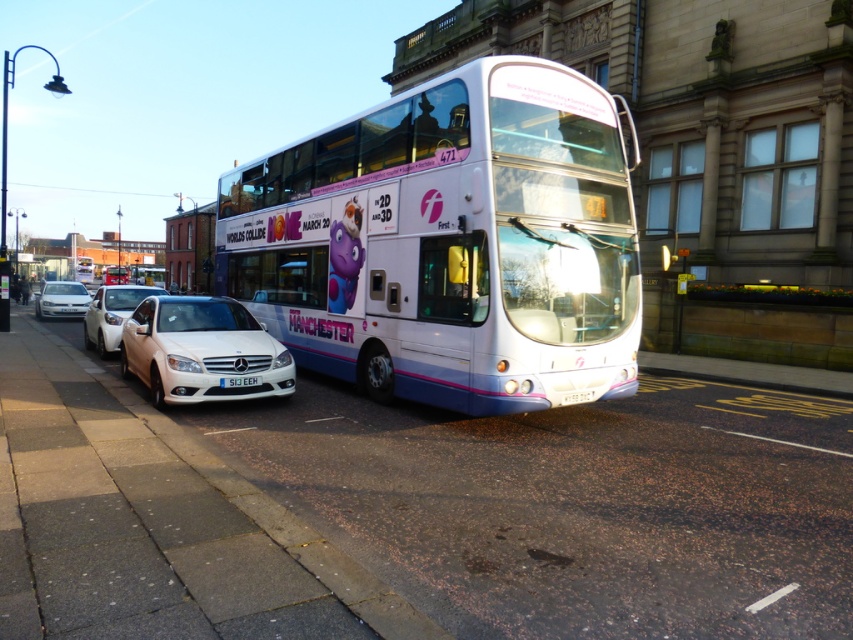
Which is more to the left, silver metallic sedan at left or white plastic license plate at center?

silver metallic sedan at left is more to the left.

Who is more distant from viewer, (x=83, y=314) or (x=247, y=381)?

The point (x=83, y=314) is more distant.

Find the location of a particular element. The width and height of the screenshot is (853, 640). silver metallic sedan at left is located at coordinates (61, 300).

Can you confirm if white glossy sedan at center is wider than white plastic license plate at center?

Correct, the width of white glossy sedan at center exceeds that of white plastic license plate at center.

Which of these two, white glossy sedan at center or white plastic license plate at center, stands taller?

With more height is white glossy sedan at center.

Is point (144, 344) closer to viewer compared to point (238, 381)?

That is False.

The image size is (853, 640). What are the coordinates of `white glossy sedan at center` in the screenshot? It's located at (201, 349).

Is white glossy bus at center thinner than white plastic license plate at center?

No, white glossy bus at center is not thinner than white plastic license plate at center.

Who is taller, white glossy bus at center or white plastic license plate at center?

white glossy bus at center

The height and width of the screenshot is (640, 853). Identify the location of white glossy bus at center. (450, 243).

Where is `white glossy bus at center`? Image resolution: width=853 pixels, height=640 pixels. white glossy bus at center is located at coordinates (450, 243).